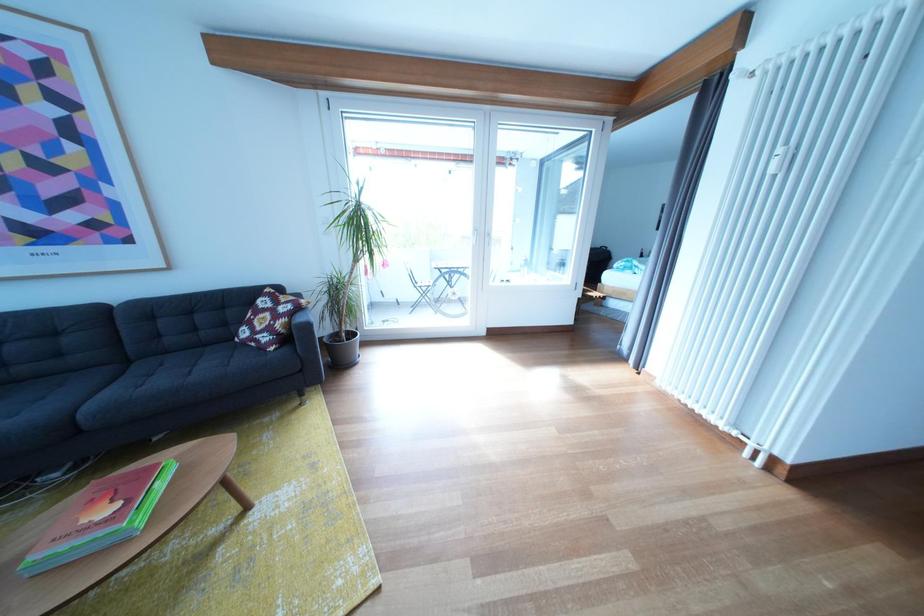
Identify the location of potted plant. (350, 265).